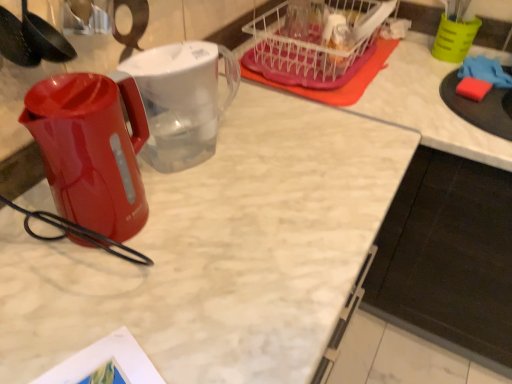
Find the location of a particular element. Image resolution: width=512 pixels, height=384 pixels. free point above glossy plastic kettle at left (from a real-world perspective) is located at coordinates (71, 96).